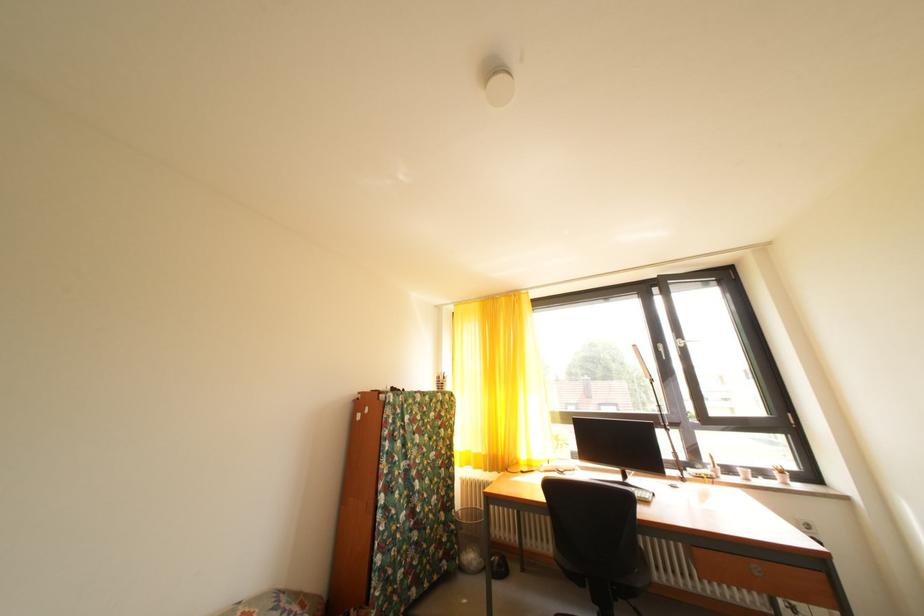
Which object does [469,539] point to?

This point indicates the wire mesh trashcan.